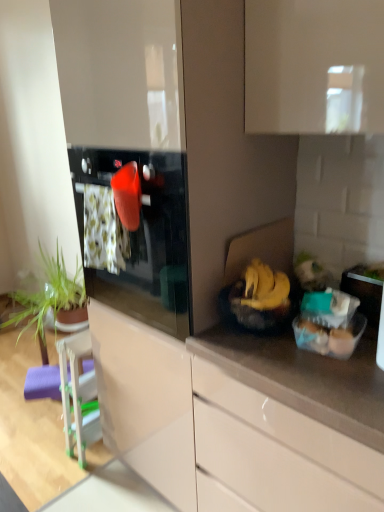
Locate an element on the screen. free space above translucent plastic eggs at right (from a real-world perspective) is located at coordinates (327, 320).